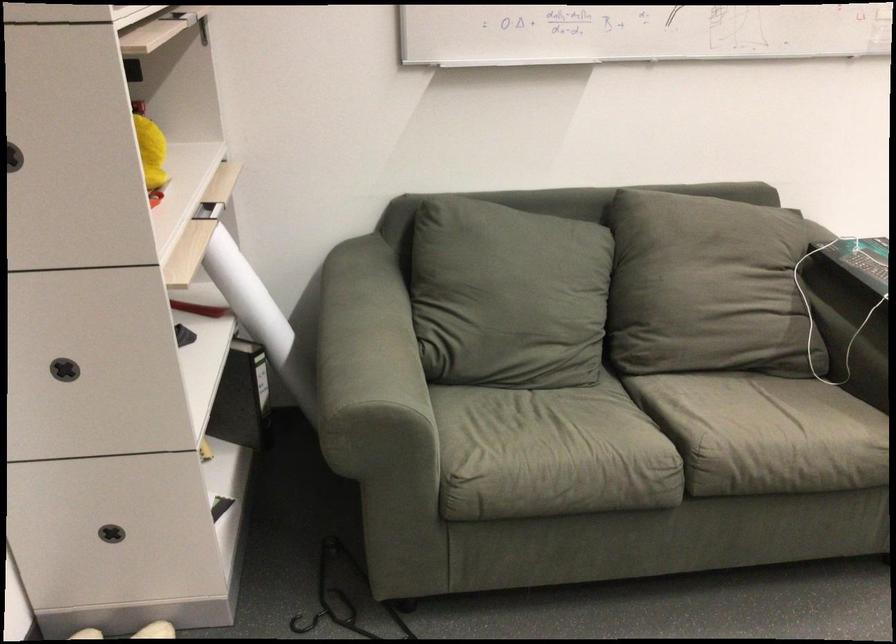
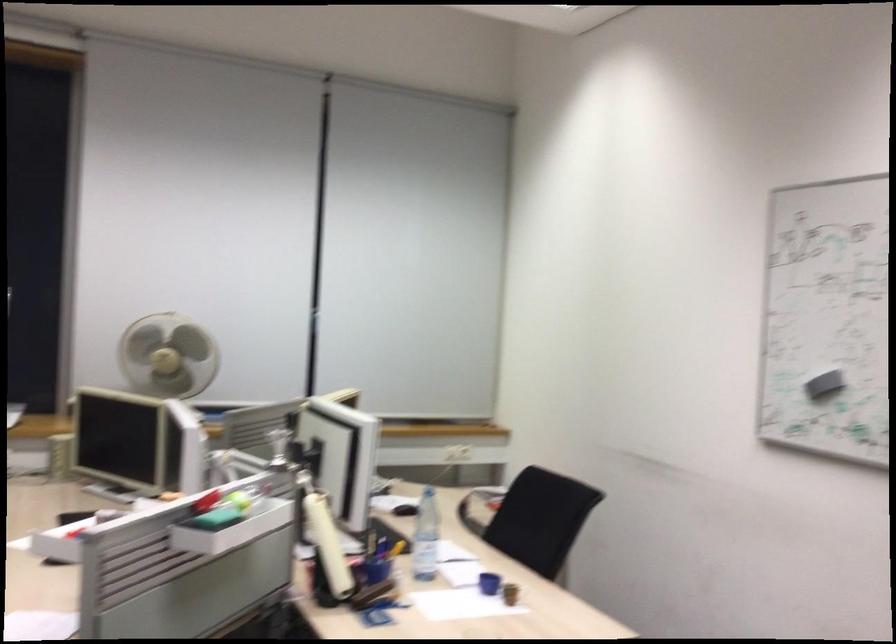
Question: Based on the continuous images, in which direction is the camera rotating? Reply with the corresponding letter.

Choices:
 (A) Left
 (B) Right
 (C) Up
 (D) Down

Answer: (B)